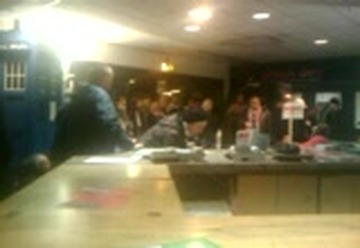
Where is `white ceiling tile`? white ceiling tile is located at coordinates (302, 27).